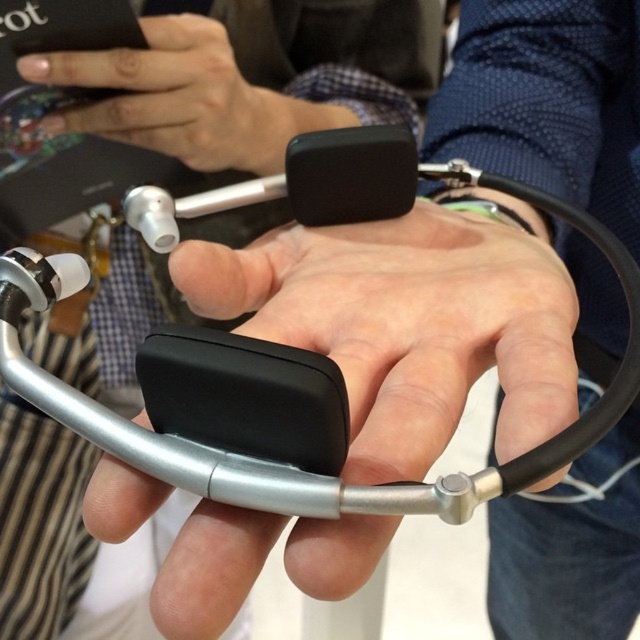
You are a medical professional attending a conference and need to locate your devices. You have a black matte earbud at center and a matte black phone at upper left. Which device is closer to the bottom of the image?

The black matte earbud at center is positioned under the matte black phone at upper left, meaning it is closer to the bottom of the image.

You are a photographer adjusting your camera settings. You notice the black matte stethoscope at center and the matte black phone at upper left in your frame. Which object should you focus on first if you want to capture both clearly?

The black matte stethoscope at center should be focused on first because it is closer to the viewer than the matte black phone at upper left, ensuring both will be in focus when starting from the closer object.